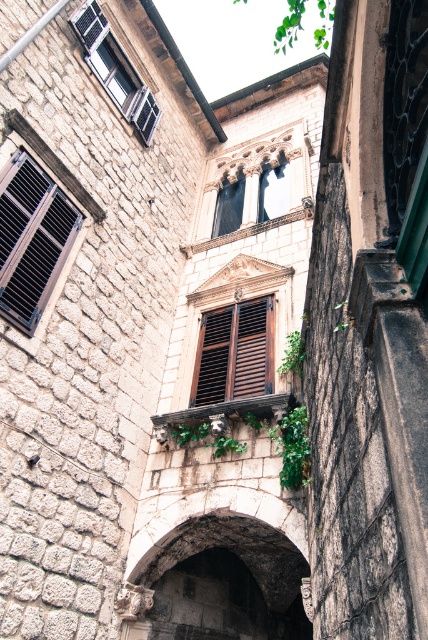
Is matte black shutters at upper left shorter than green leafy ivy at upper center?

Correct, matte black shutters at upper left is not as tall as green leafy ivy at upper center.

Between matte black shutters at upper left and green leafy ivy at upper center, which one is positioned lower?

matte black shutters at upper left is below.

Locate an element on the screen. The image size is (428, 640). matte black shutters at upper left is located at coordinates (115, 68).

Consider the image. Which is more to the right, matte black shutters at left or matte black shutters at upper left?

matte black shutters at upper left

Is matte black shutters at left behind matte black shutters at upper left?

No.

Measure the distance between matte black shutters at left and camera.

matte black shutters at left and camera are 8.04 meters apart.

In order to click on matte black shutters at left in this screenshot , I will do `click(32, 237)`.

Does point (163, 620) come in front of point (332, 22)?

Yes, it is.

Can you confirm if dark stone archway at center is positioned to the right of green leafy ivy at upper center?

No, dark stone archway at center is not to the right of green leafy ivy at upper center.

Is point (178, 577) less distant than point (294, 3)?

Yes, point (178, 577) is in front of point (294, 3).

You are a GUI agent. You are given a task and a screenshot of the screen. Output one action in this format:
    pyautogui.click(x=<x>, y=<y>)
    Task: Click on the dark stone archway at center
    Image resolution: width=428 pixels, height=640 pixels.
    Given the screenshot: What is the action you would take?
    pyautogui.click(x=222, y=582)